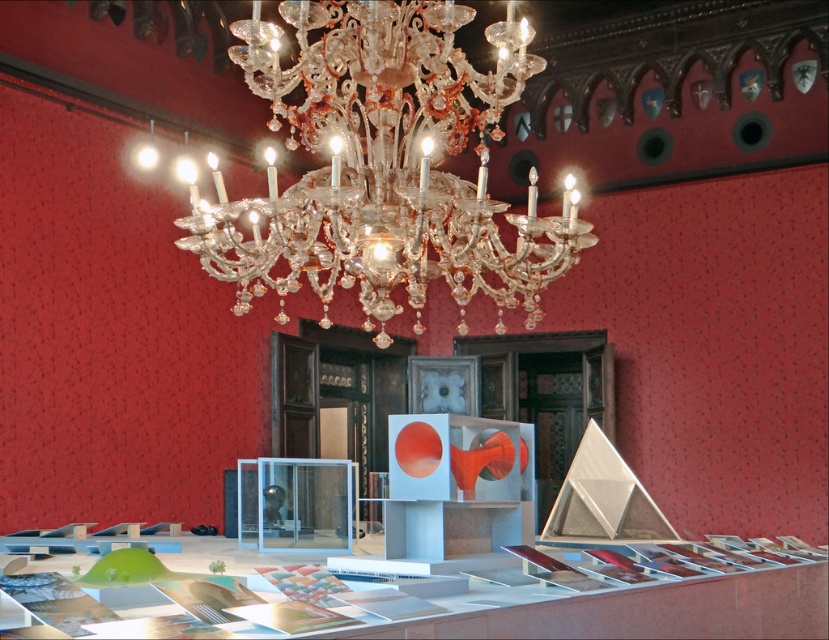
Question: Which point appears farthest from the camera in this image?

Choices:
 (A) (216, 264)
 (B) (452, 611)

Answer: (A)

Question: Is clear crystal chandelier at upper center below translucent white table at lower center?

Choices:
 (A) yes
 (B) no

Answer: (B)

Question: Considering the relative positions of clear crystal chandelier at upper center and translucent white table at lower center in the image provided, where is clear crystal chandelier at upper center located with respect to translucent white table at lower center?

Choices:
 (A) below
 (B) above

Answer: (B)

Question: Can you confirm if clear crystal chandelier at upper center is positioned above translucent white table at lower center?

Choices:
 (A) no
 (B) yes

Answer: (B)

Question: Which point is farther from the camera taking this photo?

Choices:
 (A) pyautogui.click(x=366, y=636)
 (B) pyautogui.click(x=420, y=97)

Answer: (B)